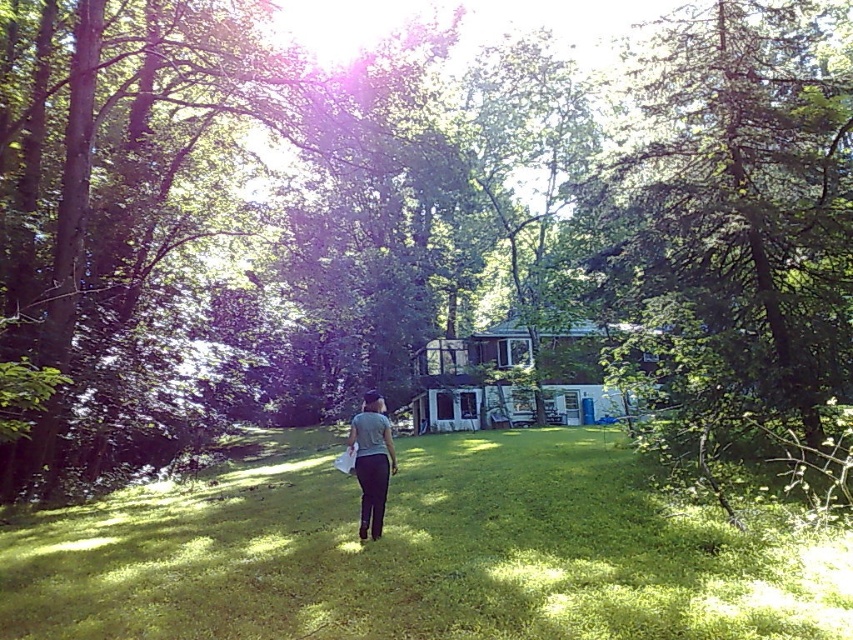
You are a photographer trying to capture the entire scene in one shot. Given that the gray matte shirt at center and the green grassy lawn at center are both in the frame, which object will occupy more of the image area?

The green grassy lawn at center is larger in size than the gray matte shirt at center, so it will occupy more of the image area.

You are standing at the point marked as point (x=418, y=554) in the image. Looking around, you see the green grassy lawn at center and the house surrounded by trees. Which direction should you walk to reach the house?

Since the green grassy lawn at center is located at point (x=418, y=554), you should walk towards the direction where the house is situated, which is away from the camera as indicated by the person walking towards it. However, the exact direction relative to the point requires knowing the image coordinate system. Assuming standard coordinates, moving towards higher y or x might align with the house direction, but without explicit spatial relations between the point and house, precise direction can only be ded

You are standing in the grassy area and want to walk towards the house. There are two points marked on the path. The first point is at coordinate point(x=247, y=538) and the second point is at coordinate point(x=376, y=490). Which point should you step on first to reach the house more quickly?

You should step on point(x=247, y=538) first because it is closer to you than point(x=376, y=490), which is further away from the camera.